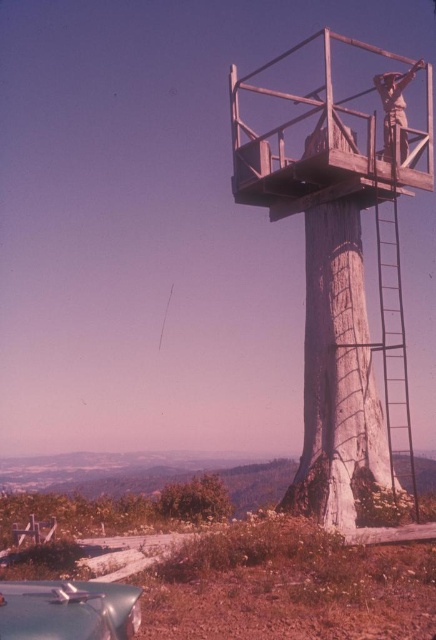
You are a hiker standing at the base of the observation tower. You see the shiny metallic car at lower left and the rusty metal figure at upper right. Which object is positioned higher in the image?

The rusty metal figure at upper right is positioned higher than the shiny metallic car at lower left.

You are a park ranger assessing the view from the observation tower. Which object, the weathered wood tree trunk at center or the green leafy tree at lower left, would block your view more when looking straight ahead?

The weathered wood tree trunk at center is taller than the green leafy tree at lower left, so it would block your view more when looking straight ahead.